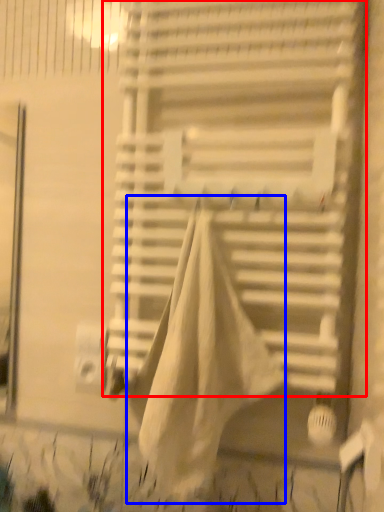
Question: Which point is closer to the camera, window blind (highlighted by a red box) or blanket (highlighted by a blue box)?

Choices:
 (A) window blind
 (B) blanket

Answer: (B)